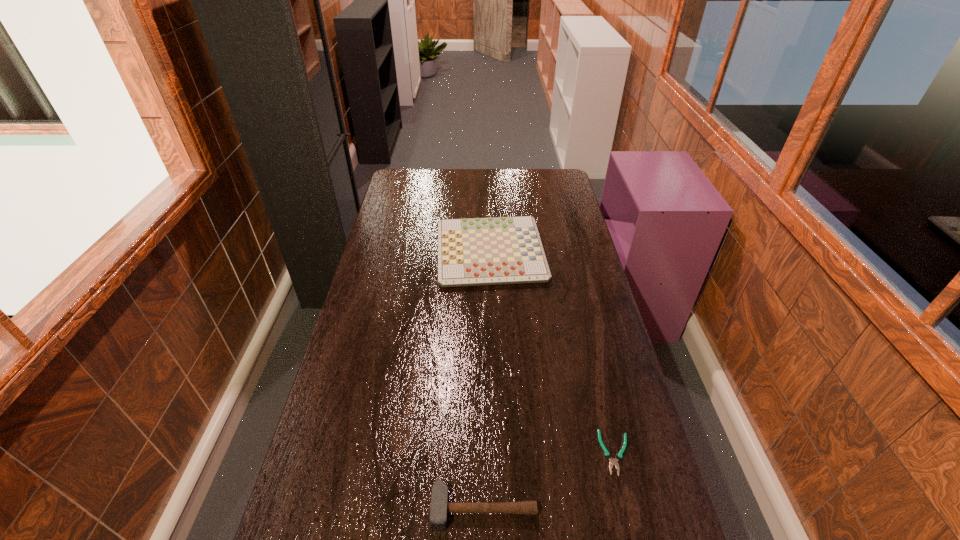
At what (x,y) coordinates should I click in order to perform the action: click on object that is the second closest one to the second farthest object. Please return your answer as a coordinate pair (x, y). Image resolution: width=960 pixels, height=540 pixels. Looking at the image, I should click on (496, 250).

Point out which object is positioned as the second nearest to the farthest object. Please provide its 2D coordinates. Your answer should be formatted as a tuple, i.e. [(x, y)], where the tuple contains the x and y coordinates of a point satisfying the conditions above.

[(439, 507)]